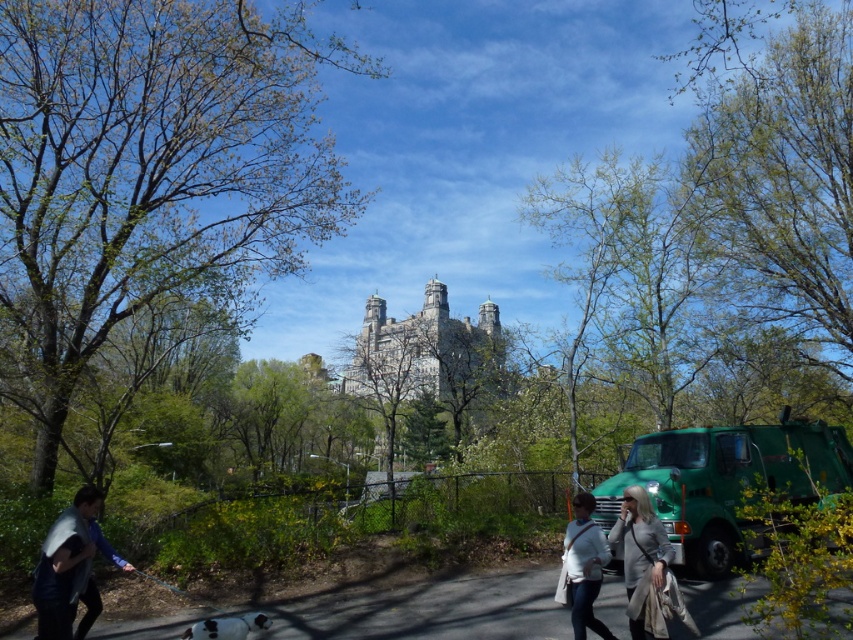
Does point (335, 604) come in front of point (44, 566)?

No.

Does smooth asphalt path at center lie in front of denim jacket at lower left?

No, it is behind denim jacket at lower left.

Between point (519, 609) and point (82, 484), which one is positioned in front?

Point (519, 609) is in front.

Locate an element on the screen. smooth asphalt path at center is located at coordinates (430, 611).

Does point (39, 557) come closer to viewer compared to point (581, 609)?

Yes, it is.

At what (x,y) coordinates should I click in order to perform the action: click on denim jacket at lower left. Please return your answer as a coordinate pair (x, y). Looking at the image, I should click on (68, 566).

Who is taller, denim jacket at lower left or gray wool coat at lower right?

gray wool coat at lower right

Can you confirm if denim jacket at lower left is thinner than gray wool coat at lower right?

No, denim jacket at lower left is not thinner than gray wool coat at lower right.

Between point (45, 577) and point (645, 628), which one is positioned behind?

Point (645, 628)

At what (x,y) coordinates should I click in order to perform the action: click on denim jacket at lower left. Please return your answer as a coordinate pair (x, y). Looking at the image, I should click on (68, 566).